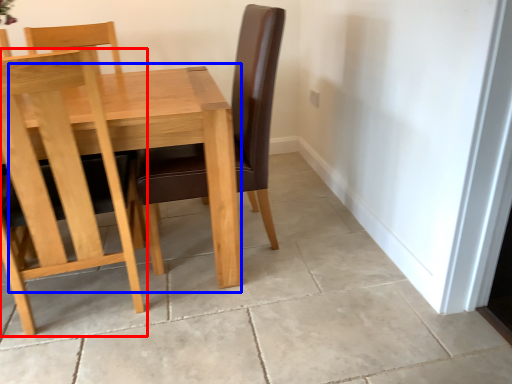
Question: Among these objects, which one is nearest to the camera, chair (highlighted by a red box) or table (highlighted by a blue box)?

Choices:
 (A) chair
 (B) table

Answer: (A)